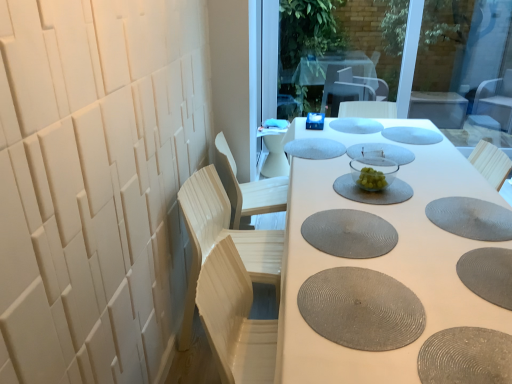
You are a GUI agent. You are given a task and a screenshot of the screen. Output one action in this format:
    pyautogui.click(x=<x>, y=<y>)
    Task: Click on the free point behind clear glass bowl at center
    The height and width of the screenshot is (384, 512).
    Given the screenshot: What is the action you would take?
    pyautogui.click(x=360, y=168)